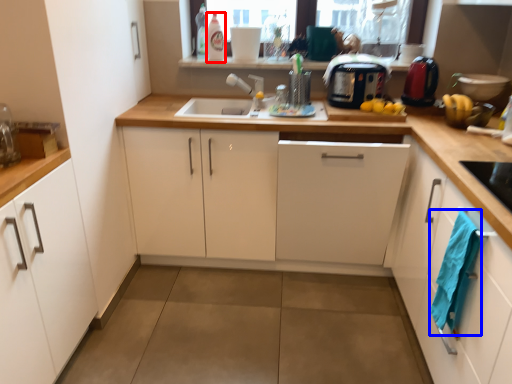
Question: Which object appears farthest to the camera in this image, bottle (highlighted by a red box) or laundry (highlighted by a blue box)?

Choices:
 (A) bottle
 (B) laundry

Answer: (A)